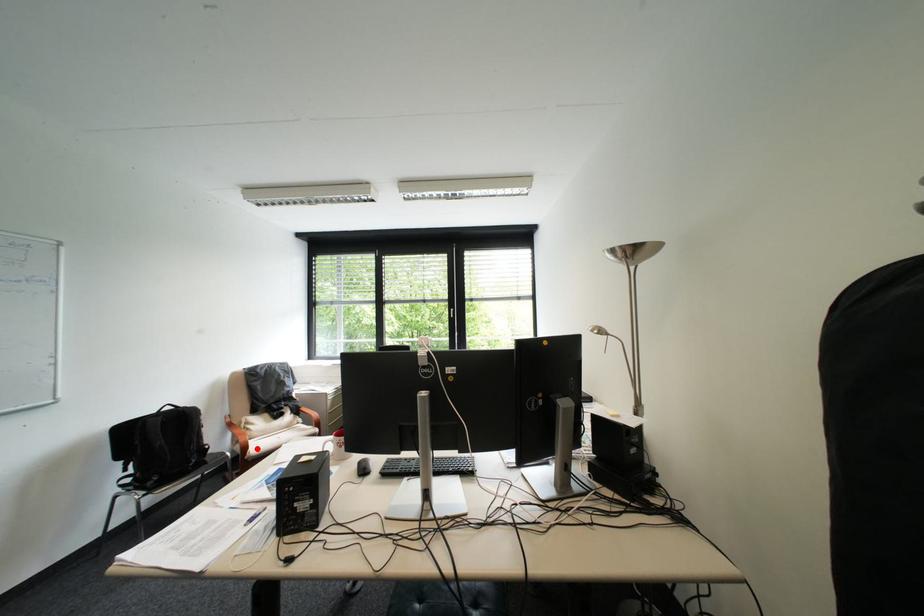
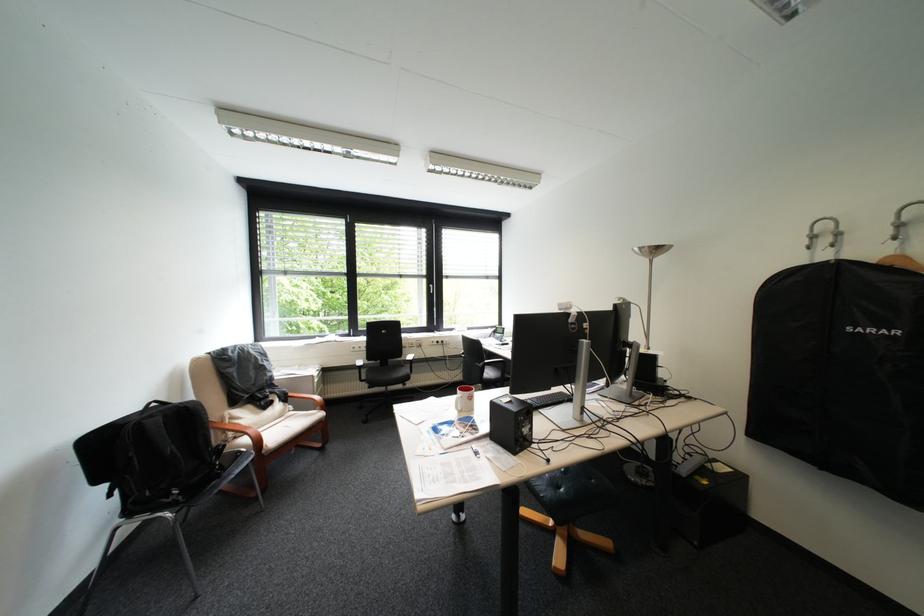
In the second image, find the point that corresponds to the highlighted location in the first image.

(271, 443)